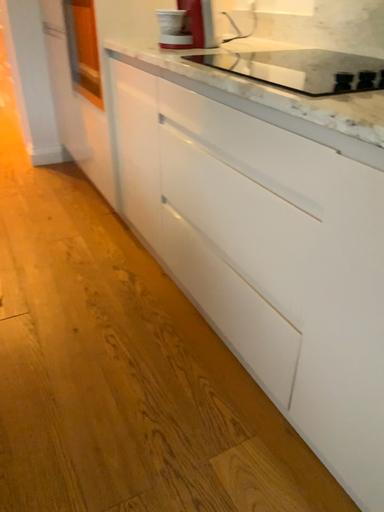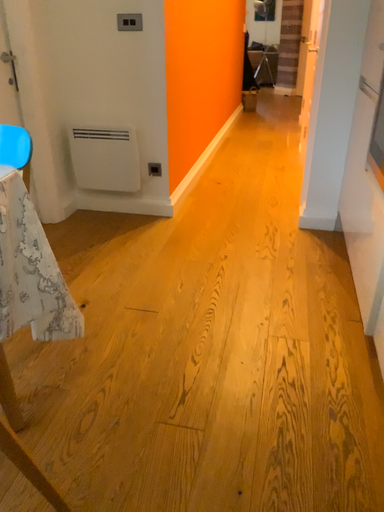
Question: How did the camera likely rotate when shooting the video?

Choices:
 (A) rotated downward
 (B) rotated upward

Answer: (B)